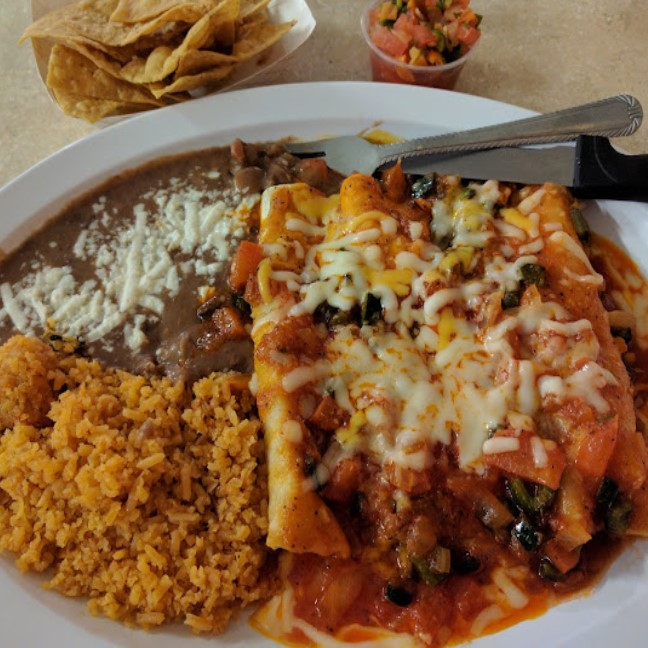
Locate an element on the screen. plastic pot is located at coordinates (454, 76).